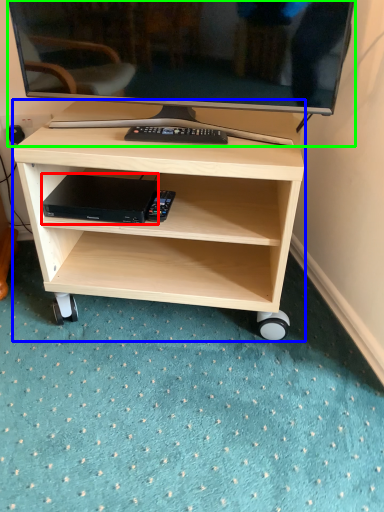
Question: Which object is the farthest from computer (highlighted by a red box)? Choose among these: desk (highlighted by a blue box) or television (highlighted by a green box).

Choices:
 (A) desk
 (B) television

Answer: (B)